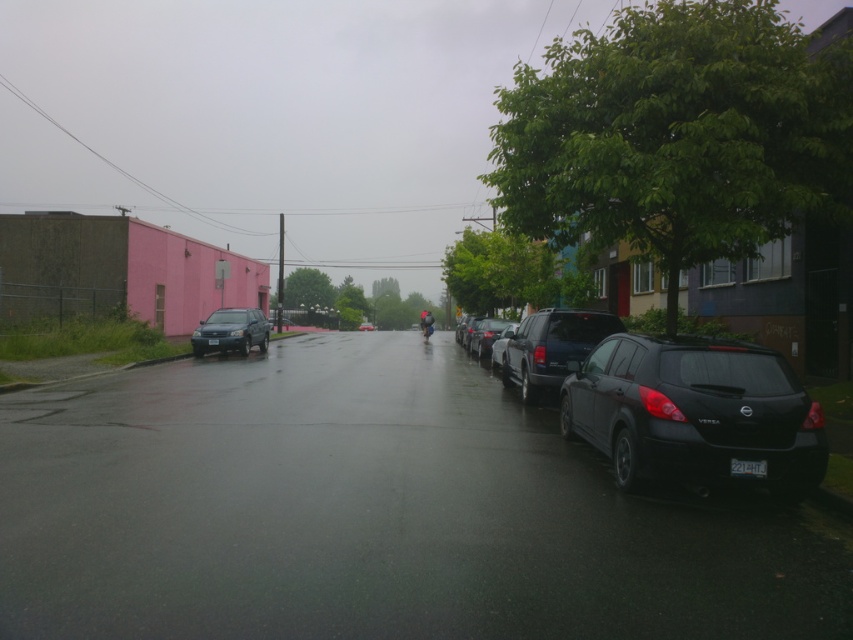
Question: Is matte black suv at right below shiny dark blue suv at right?

Choices:
 (A) no
 (B) yes

Answer: (B)

Question: Does satin black sedan at left appear over shiny black car at center?

Choices:
 (A) no
 (B) yes

Answer: (A)

Question: Considering the real-world distances, which object is farthest from the satin black sedan at center?

Choices:
 (A) shiny dark blue suv at right
 (B) shiny black car at center
 (C) satin black sedan at left

Answer: (B)

Question: Which point is closer to the camera taking this photo?

Choices:
 (A) (511, 324)
 (B) (535, 365)
 (C) (262, 346)
 (D) (482, 337)

Answer: (B)

Question: Is satin black sedan at center bigger than satin black suv at center?

Choices:
 (A) no
 (B) yes

Answer: (B)

Question: Which object appears farthest from the camera in this image?

Choices:
 (A) shiny dark blue suv at right
 (B) satin black suv at center

Answer: (B)